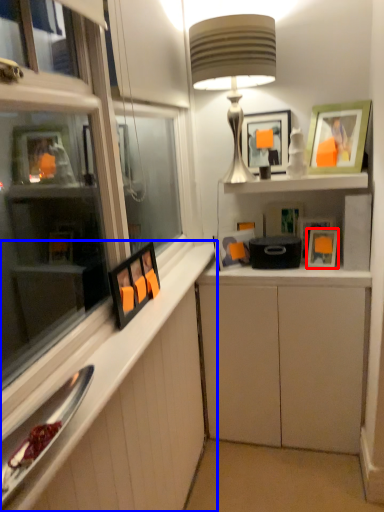
Question: Which object is further to the camera taking this photo, picture frame (highlighted by a red box) or cabinetry (highlighted by a blue box)?

Choices:
 (A) picture frame
 (B) cabinetry

Answer: (A)